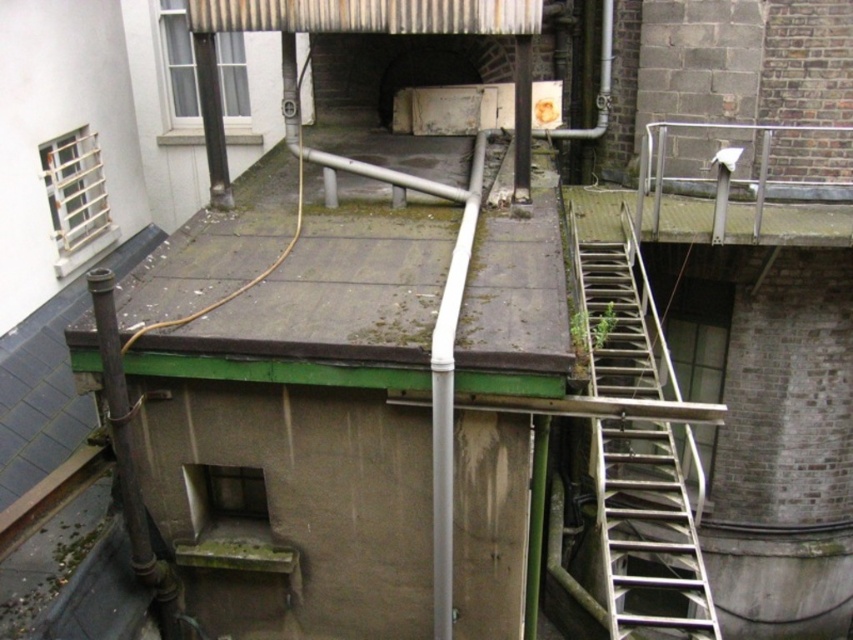
Question: Is metallic silver ladder at right bigger than rusty corrugated metal roof at upper center?

Choices:
 (A) no
 (B) yes

Answer: (B)

Question: Which of the following is the closest to the observer?

Choices:
 (A) metallic silver ladder at right
 (B) rusty corrugated metal roof at upper center

Answer: (B)

Question: Among these objects, which one is farthest from the camera?

Choices:
 (A) metallic silver ladder at right
 (B) rusty corrugated metal roof at upper center

Answer: (A)

Question: Among these points, which one is nearest to the camera?

Choices:
 (A) (645, 566)
 (B) (407, 19)

Answer: (B)

Question: Can you confirm if metallic silver ladder at right is smaller than rusty corrugated metal roof at upper center?

Choices:
 (A) no
 (B) yes

Answer: (A)

Question: Does metallic silver ladder at right have a smaller size compared to rusty corrugated metal roof at upper center?

Choices:
 (A) yes
 (B) no

Answer: (B)